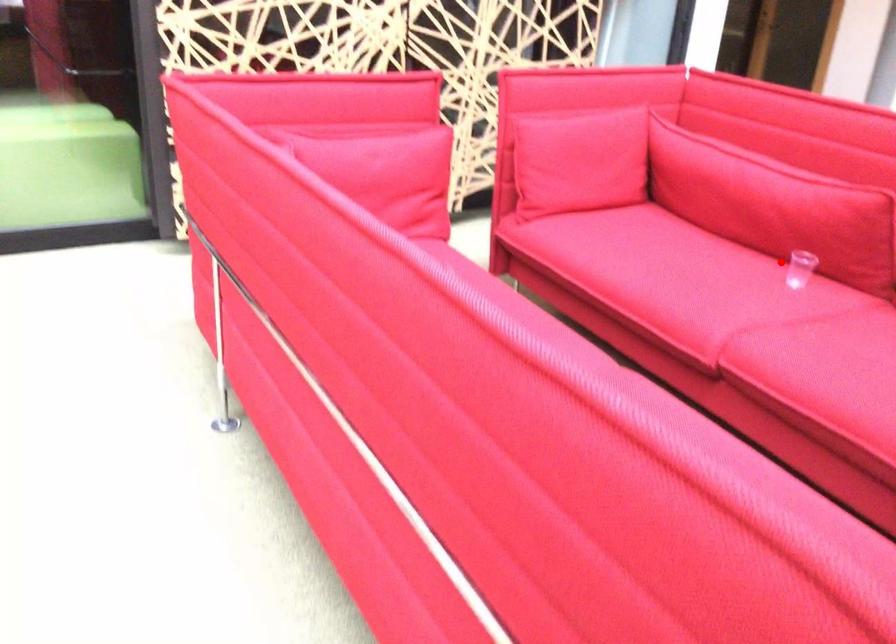
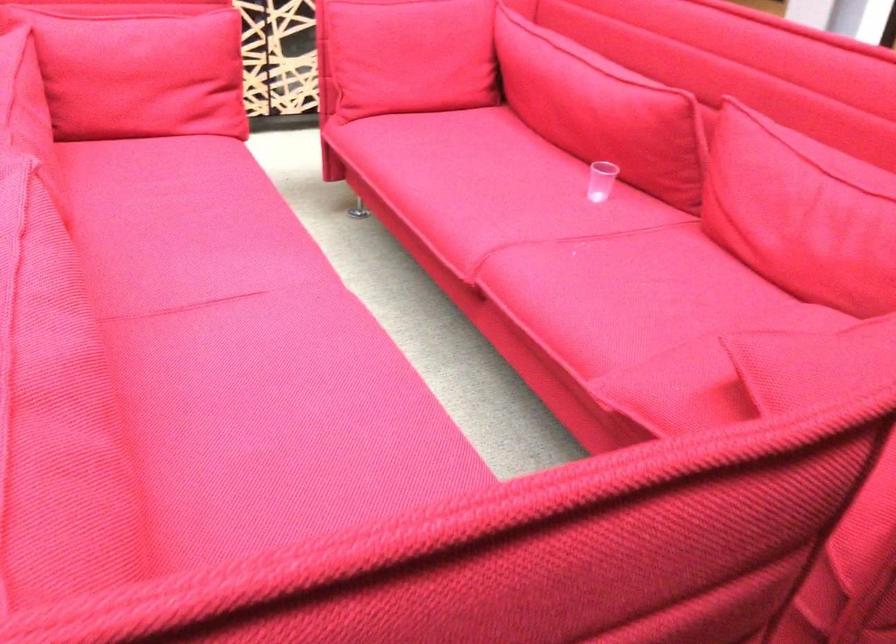
The point at the highlighted location is marked in the first image. Where is the corresponding point in the second image?

(600, 180)